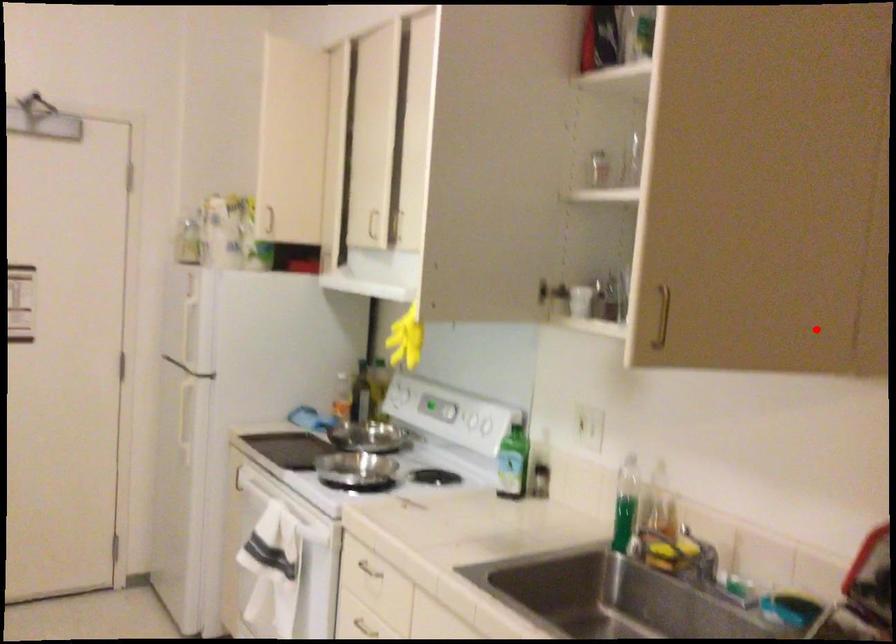
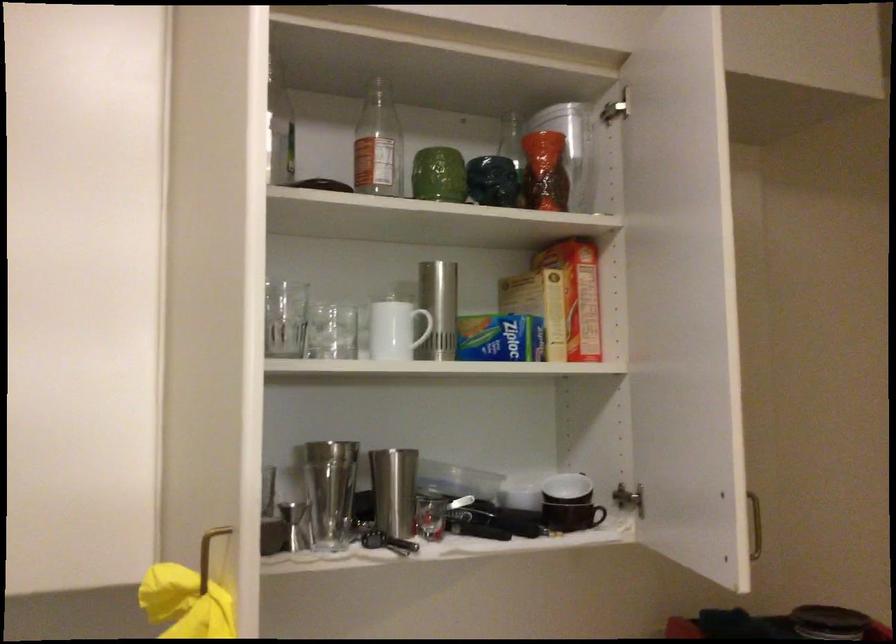
Question: A red point is marked in image1. In image2, is the corresponding 3D point closer to the camera or farther? Reply with the corresponding letter.

Choices:
 (A) The corresponding 3D point is closer.
 (B) The corresponding 3D point is farther.

Answer: (B)